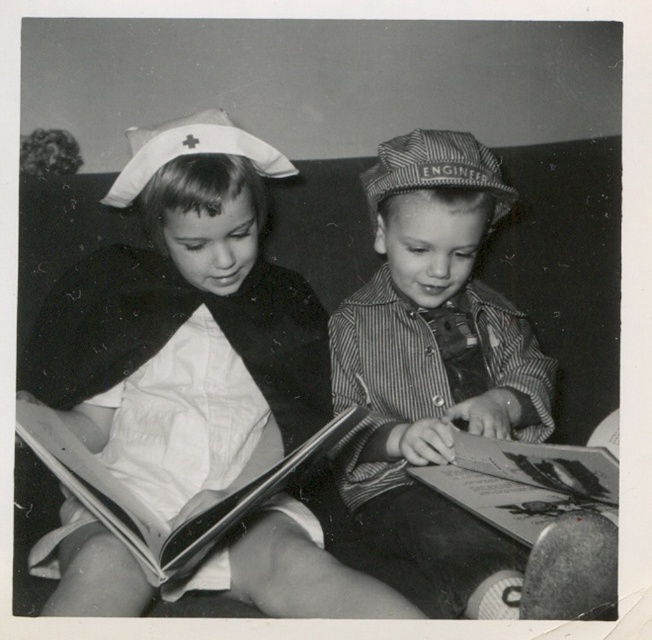
You are a photographer who wants to capture a closeup of the paperboard book at lower center without the white cloth dress at center blocking the view. Can you move closer to the book to take the photo?

The white cloth dress at center is further to the viewer than paperboard book at lower center, so moving closer to the book would bring it nearer to you, potentially allowing you to position yourself so that the dress no longer blocks the view of the book.

You are a photographer analyzing the composition of this black and white photo. You notice a point at coordinates (x=186, y=330). What object is located at this point?

The point at coordinates (x=186, y=330) indicates the white cloth dress at center.

You are a tailor who needs to determine which item is wider between the white cloth dress at center and the thick paper book at lower left. Which one is wider?

The white cloth dress at center is wider than the thick paper book at lower left according to the description.